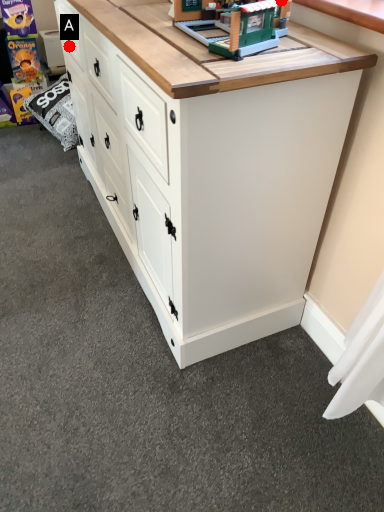
Question: Two points are circled on the image, labeled by A and B beside each circle. Which point appears closest to the camera in this image?

Choices:
 (A) A is closer
 (B) B is closer

Answer: (B)